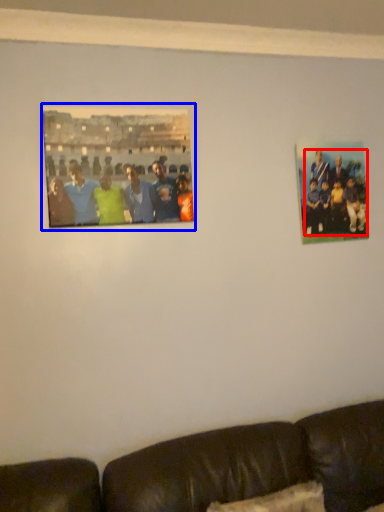
Question: Which object is closer to the camera taking this photo, person (highlighted by a red box) or picture frame (highlighted by a blue box)?

Choices:
 (A) person
 (B) picture frame

Answer: (B)